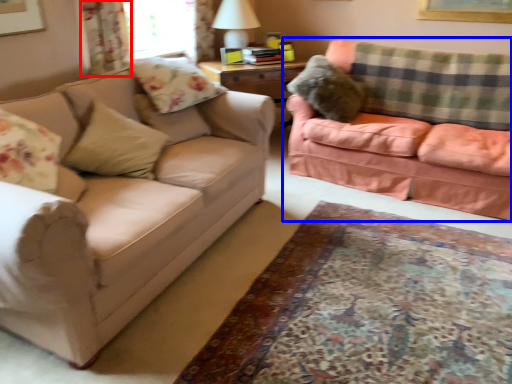
Question: Which point is closer to the camera, curtain (highlighted by a red box) or studio couch (highlighted by a blue box)?

Choices:
 (A) curtain
 (B) studio couch

Answer: (B)